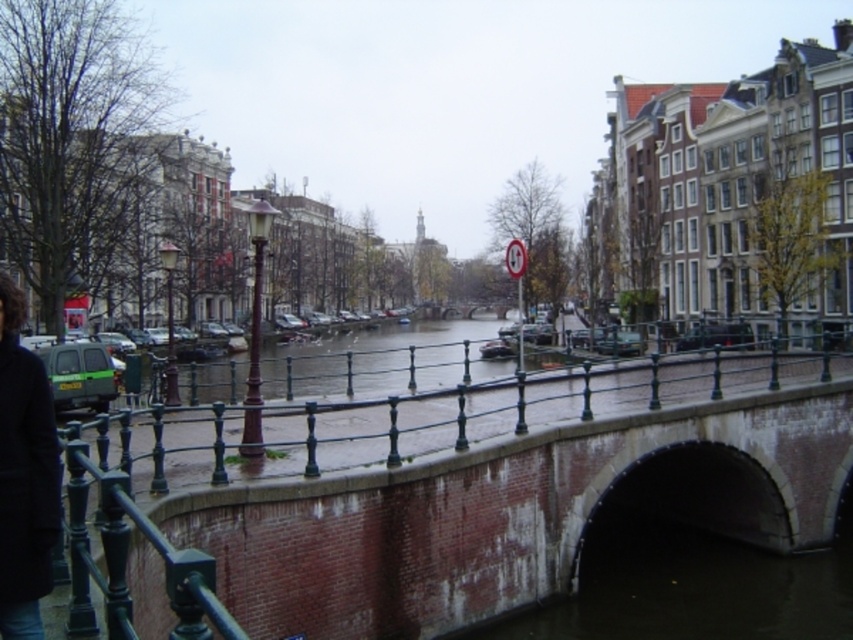
Describe the element at coordinates (523, 500) in the screenshot. This screenshot has height=640, width=853. I see `brick bridge at center` at that location.

Is brick bridge at center taller than black wool coat at lower left?

Correct, brick bridge at center is much taller as black wool coat at lower left.

Is point (753, 358) positioned behind point (55, 442)?

Yes, it is.

In order to click on brick bridge at center in this screenshot , I will do `click(523, 500)`.